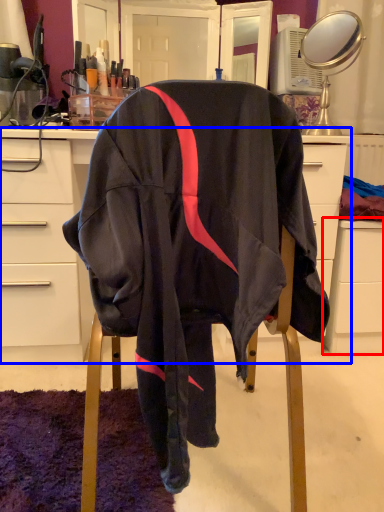
Question: Which object is further to the camera taking this photo, file cabinet (highlighted by a red box) or desk (highlighted by a blue box)?

Choices:
 (A) file cabinet
 (B) desk

Answer: (A)